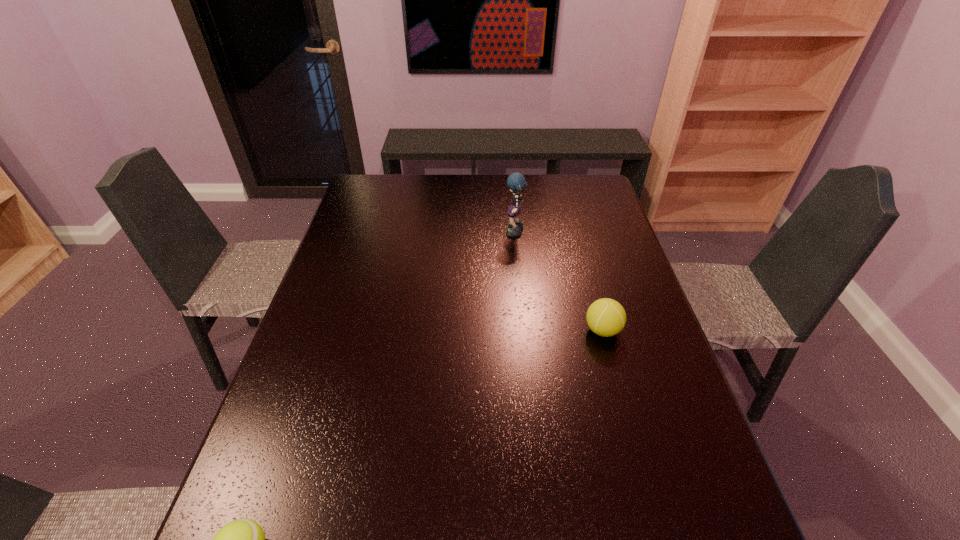
Where is `free spot that satisfies the following two spatial constraints: 1. on the front-facing side of the farthest object; 2. on the right side of the rightmost object`? This screenshot has width=960, height=540. free spot that satisfies the following two spatial constraints: 1. on the front-facing side of the farthest object; 2. on the right side of the rightmost object is located at coordinates (524, 330).

Where is `free space that satisfies the following two spatial constraints: 1. on the front-facing side of the tallest object; 2. on the right side of the rightmost object`? The height and width of the screenshot is (540, 960). free space that satisfies the following two spatial constraints: 1. on the front-facing side of the tallest object; 2. on the right side of the rightmost object is located at coordinates (524, 330).

This screenshot has height=540, width=960. What are the coordinates of `vacant space that satisfies the following two spatial constraints: 1. on the front-facing side of the tallest object; 2. on the right side of the second nearest object` in the screenshot? It's located at (524, 330).

This screenshot has height=540, width=960. In order to click on vacant space that satisfies the following two spatial constraints: 1. on the back side of the farther tennis ball; 2. on the front-facing side of the tallest object in this screenshot , I will do `click(576, 233)`.